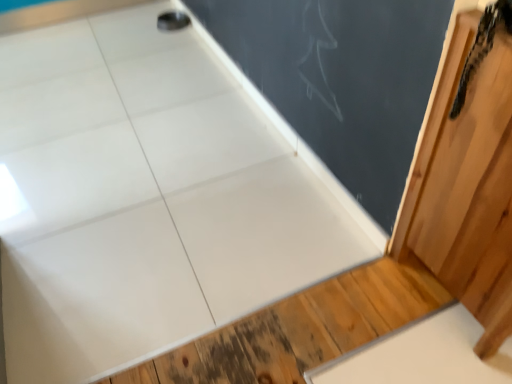
Question: Does wooden barn door at right appear on the right side of black textured snake at upper right?

Choices:
 (A) yes
 (B) no

Answer: (A)

Question: From a real-world perspective, is wooden barn door at right located higher than black textured snake at upper right?

Choices:
 (A) yes
 (B) no

Answer: (B)

Question: Is wooden barn door at right closer to camera compared to black textured snake at upper right?

Choices:
 (A) yes
 (B) no

Answer: (A)

Question: Considering the relative sizes of wooden barn door at right and black textured snake at upper right in the image provided, is wooden barn door at right shorter than black textured snake at upper right?

Choices:
 (A) yes
 (B) no

Answer: (B)

Question: Is wooden barn door at right facing towards black textured snake at upper right?

Choices:
 (A) yes
 (B) no

Answer: (A)

Question: Is wooden barn door at right further to camera compared to black textured snake at upper right?

Choices:
 (A) no
 (B) yes

Answer: (A)

Question: From the image's perspective, is wooden barn door at right above matte black chalkboard at upper center?

Choices:
 (A) no
 (B) yes

Answer: (A)

Question: From a real-world perspective, is wooden barn door at right on top of matte black chalkboard at upper center?

Choices:
 (A) yes
 (B) no

Answer: (A)

Question: Is wooden barn door at right positioned behind matte black chalkboard at upper center?

Choices:
 (A) yes
 (B) no

Answer: (B)

Question: Is wooden barn door at right positioned before matte black chalkboard at upper center?

Choices:
 (A) no
 (B) yes

Answer: (B)

Question: Is wooden barn door at right placed right next to matte black chalkboard at upper center?

Choices:
 (A) yes
 (B) no

Answer: (B)

Question: Is wooden barn door at right wider than matte black chalkboard at upper center?

Choices:
 (A) no
 (B) yes

Answer: (B)

Question: From the image's perspective, is matte black chalkboard at upper center located beneath black textured snake at upper right?

Choices:
 (A) yes
 (B) no

Answer: (B)